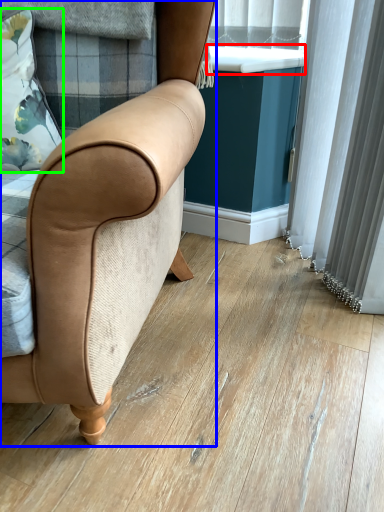
Question: Estimate the real-world distances between objects in this image. Which object is farther from window sill (highlighted by a red box), chair (highlighted by a blue box) or pillow (highlighted by a green box)?

Choices:
 (A) chair
 (B) pillow

Answer: (A)